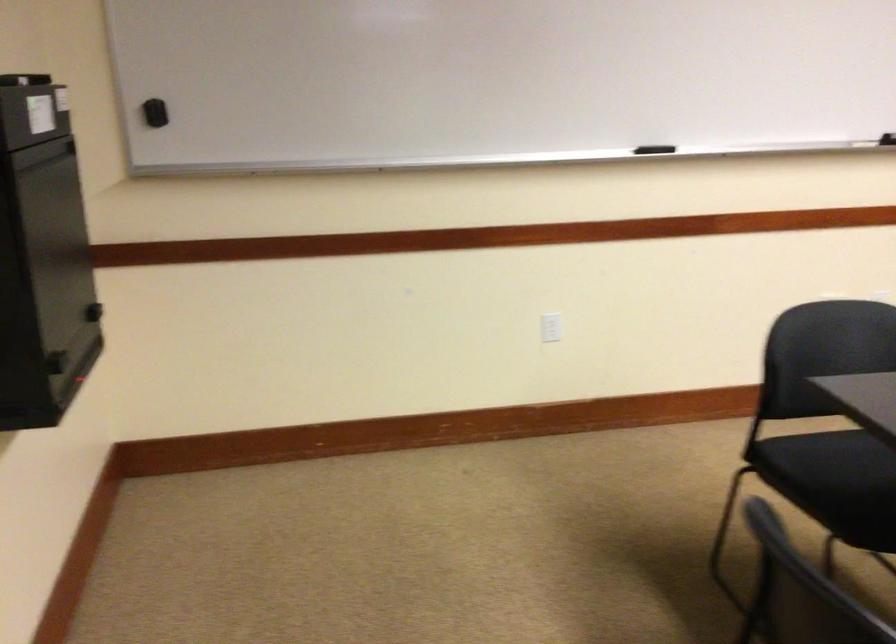
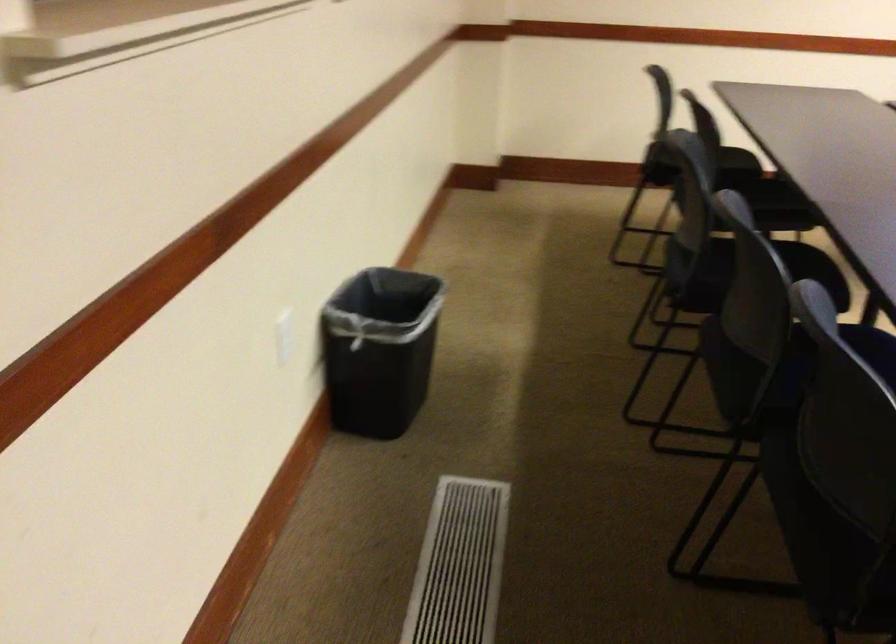
How did the camera likely rotate?

The camera's rotation is toward right-down.